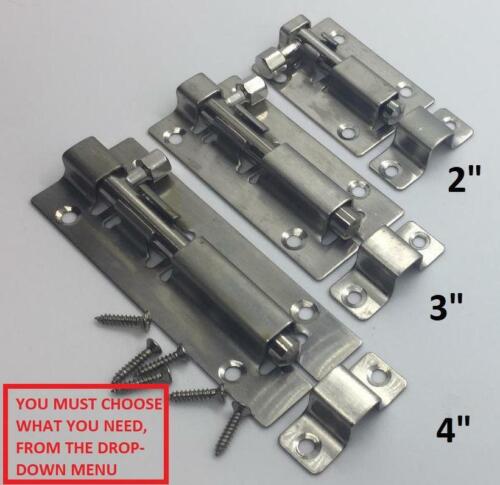
Identify the location of frame mount. The image size is (500, 485). (348, 405), (376, 254), (416, 140).